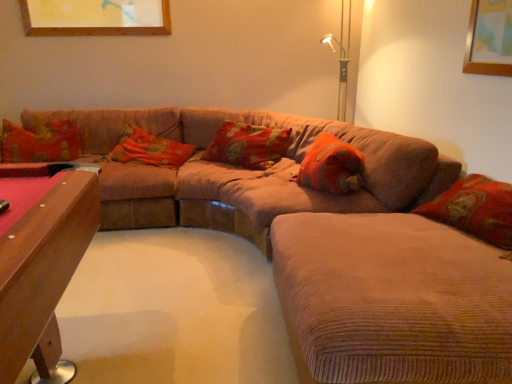
Question: From a real-world perspective, does fluffy orange pillow at center, the 1th pillow in the right-to-left sequence, stand above floral fabric pillow at center, arranged as the third pillow when viewed from the right?

Choices:
 (A) no
 (B) yes

Answer: (B)

Question: Is there a large distance between fluffy orange pillow at center, marked as the fourth pillow in a left-to-right arrangement, and floral fabric pillow at center, which is the second pillow from left to right?

Choices:
 (A) no
 (B) yes

Answer: (B)

Question: Considering the relative sizes of fluffy orange pillow at center, marked as the fourth pillow in a left-to-right arrangement, and floral fabric pillow at center, arranged as the third pillow when viewed from the right, in the image provided, is fluffy orange pillow at center, marked as the fourth pillow in a left-to-right arrangement, smaller than floral fabric pillow at center, arranged as the third pillow when viewed from the right,?

Choices:
 (A) yes
 (B) no

Answer: (A)

Question: Is fluffy orange pillow at center, the 1th pillow in the right-to-left sequence, turned away from floral fabric pillow at center, which is the second pillow from left to right?

Choices:
 (A) yes
 (B) no

Answer: (B)

Question: From the image's perspective, would you say fluffy orange pillow at center, marked as the fourth pillow in a left-to-right arrangement, is positioned over floral fabric pillow at center, arranged as the third pillow when viewed from the right?

Choices:
 (A) yes
 (B) no

Answer: (B)

Question: Considering the relative sizes of fluffy orange pillow at center, the 1th pillow in the right-to-left sequence, and floral fabric pillow at center, which is the second pillow from left to right, in the image provided, is fluffy orange pillow at center, the 1th pillow in the right-to-left sequence, thinner than floral fabric pillow at center, which is the second pillow from left to right,?

Choices:
 (A) yes
 (B) no

Answer: (A)

Question: Is corduroy textured pillow at center, which appears as the 2th pillow when viewed from the right, completely or partially inside fluffy orange pillow at center, the 1th pillow in the right-to-left sequence?

Choices:
 (A) yes
 (B) no

Answer: (B)

Question: Does fluffy orange pillow at center, marked as the fourth pillow in a left-to-right arrangement, have a greater width compared to corduroy textured pillow at center, the 3th pillow when ordered from left to right?

Choices:
 (A) no
 (B) yes

Answer: (A)

Question: Is fluffy orange pillow at center, marked as the fourth pillow in a left-to-right arrangement, positioned beyond the bounds of corduroy textured pillow at center, the 3th pillow when ordered from left to right?

Choices:
 (A) no
 (B) yes

Answer: (B)

Question: Can you confirm if fluffy orange pillow at center, marked as the fourth pillow in a left-to-right arrangement, is positioned to the left of corduroy textured pillow at center, which appears as the 2th pillow when viewed from the right?

Choices:
 (A) no
 (B) yes

Answer: (A)

Question: Considering the relative sizes of fluffy orange pillow at center, the 1th pillow in the right-to-left sequence, and corduroy textured pillow at center, the 3th pillow when ordered from left to right, in the image provided, is fluffy orange pillow at center, the 1th pillow in the right-to-left sequence, taller than corduroy textured pillow at center, the 3th pillow when ordered from left to right,?

Choices:
 (A) yes
 (B) no

Answer: (B)

Question: From a real-world perspective, is fluffy orange pillow at center, marked as the fourth pillow in a left-to-right arrangement, over corduroy textured pillow at center, the 3th pillow when ordered from left to right?

Choices:
 (A) no
 (B) yes

Answer: (A)

Question: Does corduroy textured pillow at center, which appears as the 2th pillow when viewed from the right, have a lesser width compared to corduroy couch at center?

Choices:
 (A) yes
 (B) no

Answer: (A)